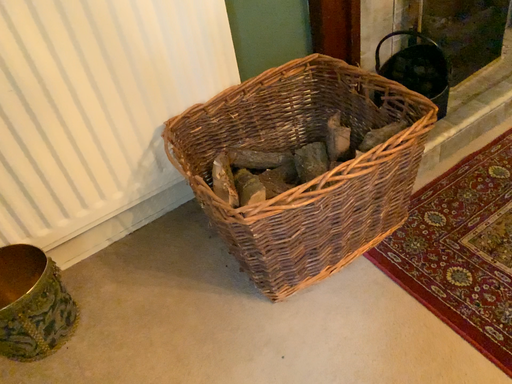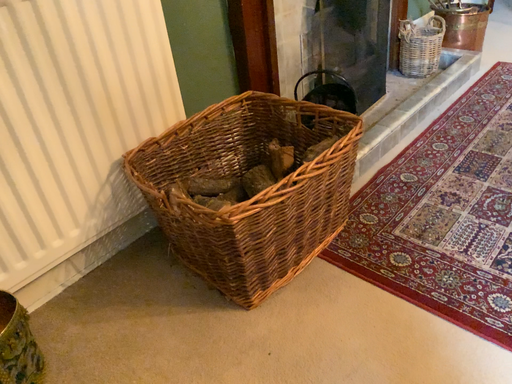
Question: How did the camera likely rotate when shooting the video?

Choices:
 (A) rotated left
 (B) rotated right

Answer: (B)